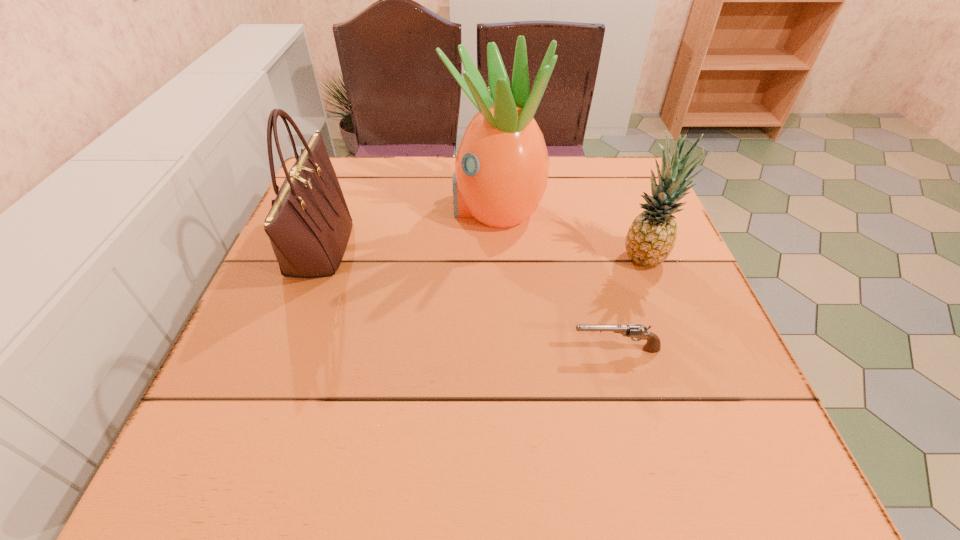
Find the location of a particular element. blank region between the gun and the shorter pineapple is located at coordinates (631, 303).

Find the location of a particular element. This screenshot has width=960, height=540. vacant space that's between the shortest object and the third object from right to left is located at coordinates (555, 279).

Find the location of a particular element. This screenshot has width=960, height=540. free space that is in between the handbag and the gun is located at coordinates (468, 299).

Image resolution: width=960 pixels, height=540 pixels. What are the coordinates of `free point between the shortest object and the handbag` in the screenshot? It's located at (468, 299).

Identify the location of free space between the leftmost object and the shortest object. This screenshot has height=540, width=960. (468, 299).

At what (x,y) coordinates should I click in order to perform the action: click on vacant area that lies between the shorter pineapple and the second object from left to right. Please return your answer as a coordinate pair (x, y). The image size is (960, 540). Looking at the image, I should click on (570, 233).

Where is `free space between the leftmost object and the taller pineapple`? This screenshot has height=540, width=960. free space between the leftmost object and the taller pineapple is located at coordinates (407, 228).

Identify which object is the second nearest to the gun. Please provide its 2D coordinates. Your answer should be formatted as a tuple, i.e. [(x, y)], where the tuple contains the x and y coordinates of a point satisfying the conditions above.

[(501, 169)]

Identify the location of object that is the third closest to the right pineapple. pyautogui.click(x=309, y=224).

Where is `vacant space that satisfies the following two spatial constraints: 1. on the front-facing side of the handbag; 2. on the back side of the shorter pineapple`? This screenshot has width=960, height=540. vacant space that satisfies the following two spatial constraints: 1. on the front-facing side of the handbag; 2. on the back side of the shorter pineapple is located at coordinates (315, 257).